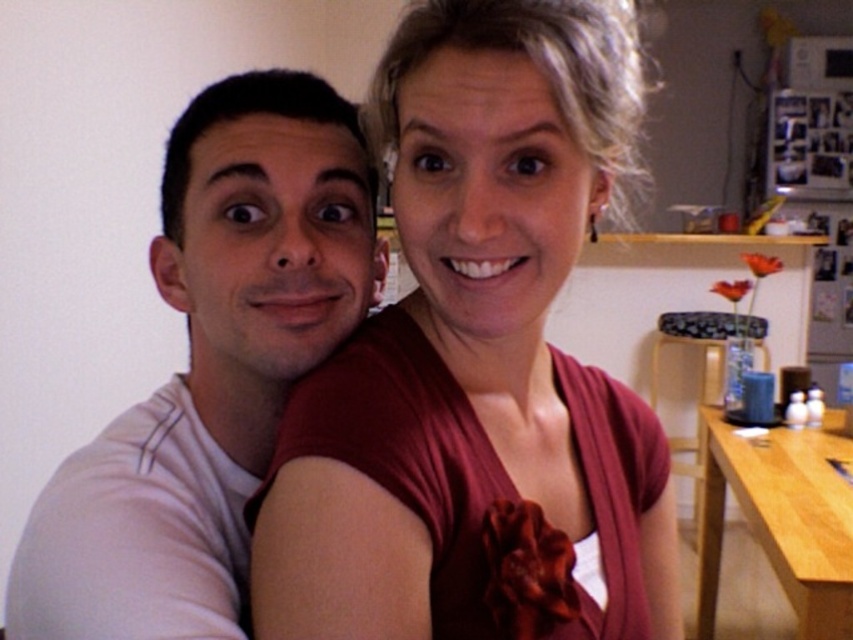
Question: Which object is farther from the camera taking this photo?

Choices:
 (A) white matte t-shirt at left
 (B) blue fabric stool at right

Answer: (B)

Question: Is white matte t-shirt at left positioned in front of blue fabric stool at right?

Choices:
 (A) no
 (B) yes

Answer: (B)

Question: Considering the relative positions of white matte t-shirt at left and blue fabric stool at right in the image provided, where is white matte t-shirt at left located with respect to blue fabric stool at right?

Choices:
 (A) left
 (B) right

Answer: (A)

Question: Among these objects, which one is nearest to the camera?

Choices:
 (A) blue fabric stool at right
 (B) white matte t-shirt at left

Answer: (B)

Question: Is white matte t-shirt at left smaller than blue fabric stool at right?

Choices:
 (A) no
 (B) yes

Answer: (B)